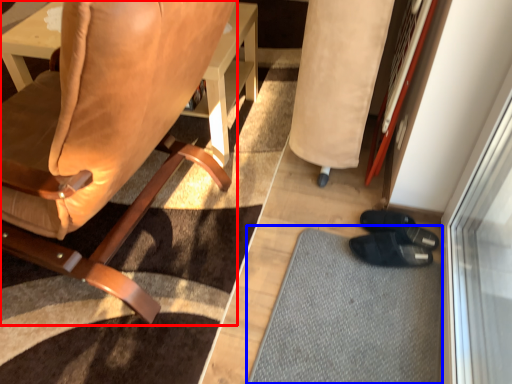
Question: Among these objects, which one is farthest to the camera, chair (highlighted by a red box) or doormat (highlighted by a blue box)?

Choices:
 (A) chair
 (B) doormat

Answer: (B)